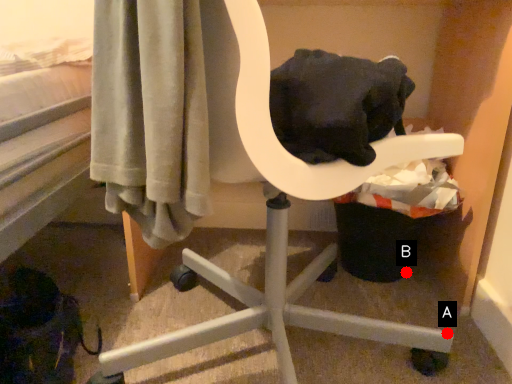
Question: Two points are circled on the image, labeled by A and B beside each circle. Which of the following is the farthest from the observer?

Choices:
 (A) A is further
 (B) B is further

Answer: (B)